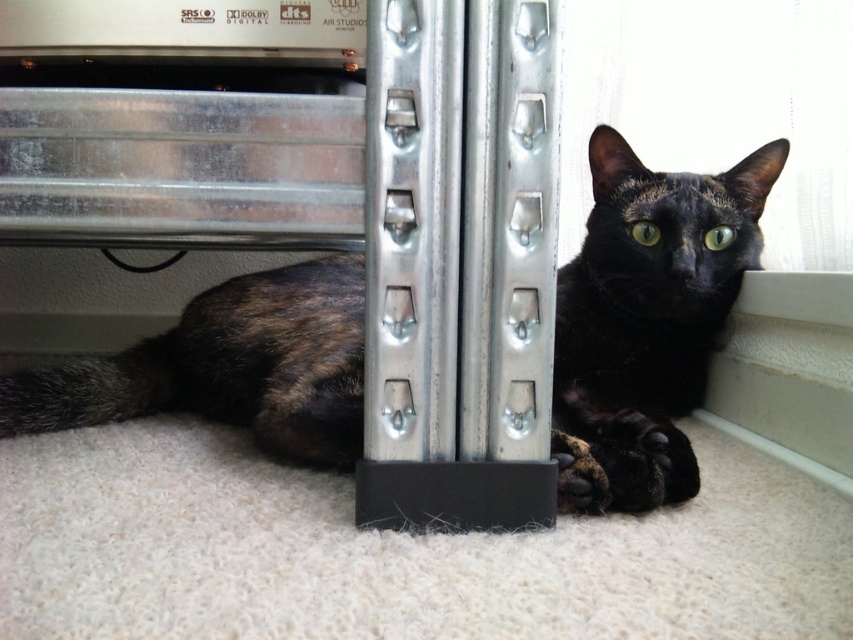
You are a photographer setting up a camera at eye level with the tortoiseshell fur cat at lower center and the black fur at lower center. Which animal will appear larger in the photo?

The tortoiseshell fur cat at lower center will appear larger in the photo because it is much taller than the black fur at lower center.

You are a photographer trying to capture the cat in the scene. You notice two points marked on the floor at coordinates point (631,337) and point (606,497). If you want to place a treat to attract the cat towards the front of the scene, which point should you choose?

You should choose point (606,497) because point (631,337) is behind it, meaning the front of the scene is closer to point (606,497).